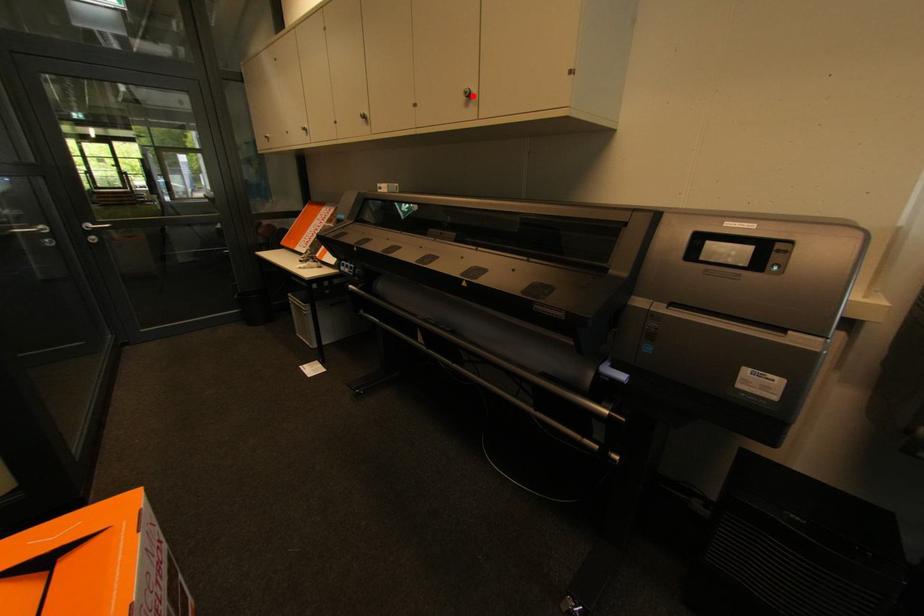
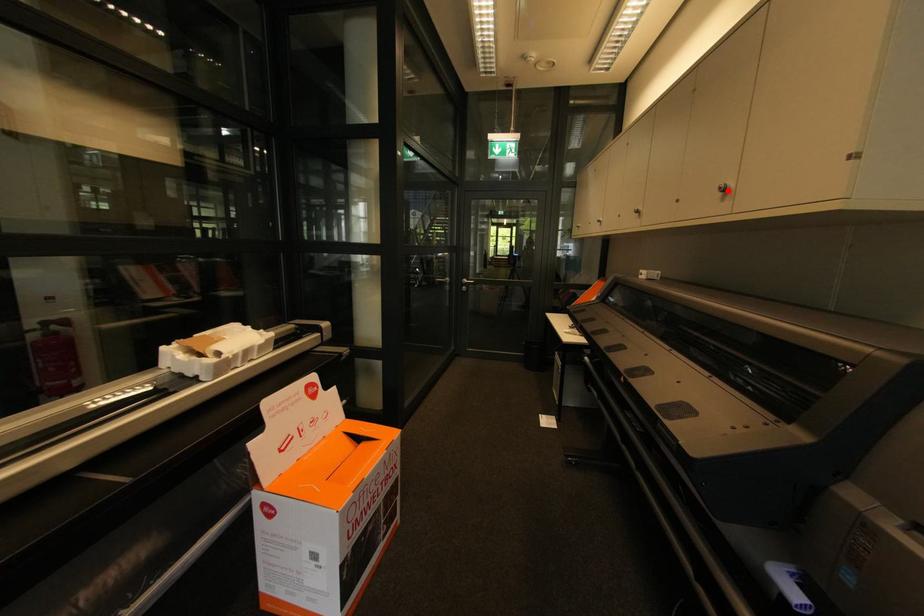
From the picture: I am providing you with two images of the same scene from different viewpoints. A red point is marked on the first image and another point is marked on the second image. Is the marked point in image1 the same physical position as the marked point in image2?

Yes